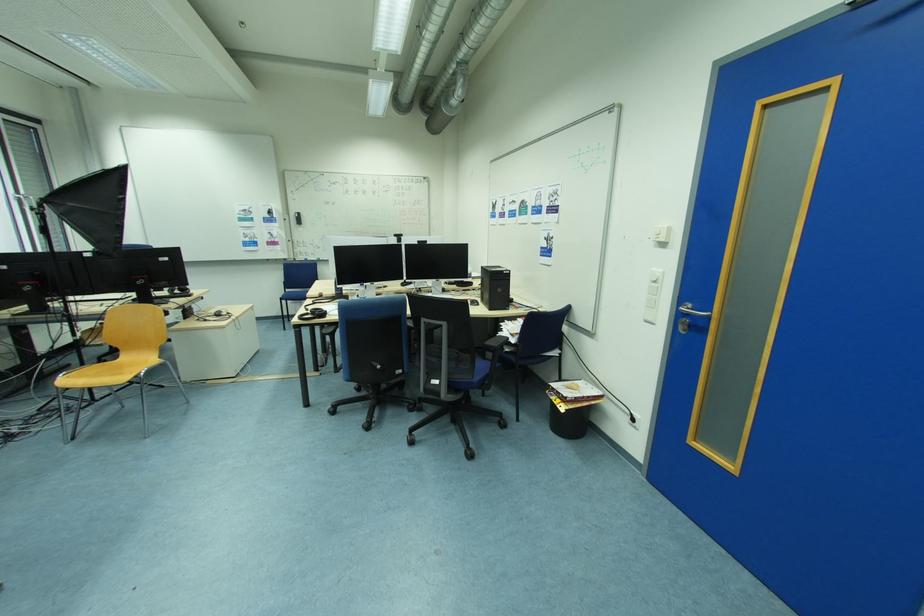
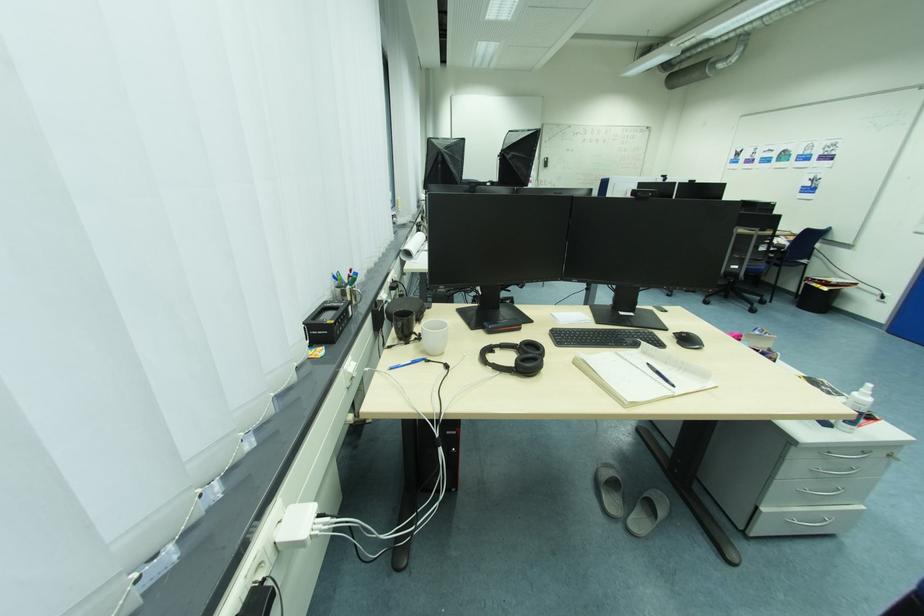
Locate, in the second image, the point that corresponds to (x=569, y=408) in the first image.

(833, 290)